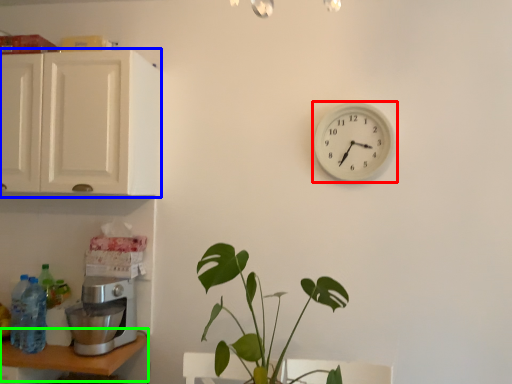
Question: Which is nearer to the wall clock (highlighted by a red box)? cabinetry (highlighted by a blue box) or table (highlighted by a green box).

Choices:
 (A) cabinetry
 (B) table

Answer: (A)